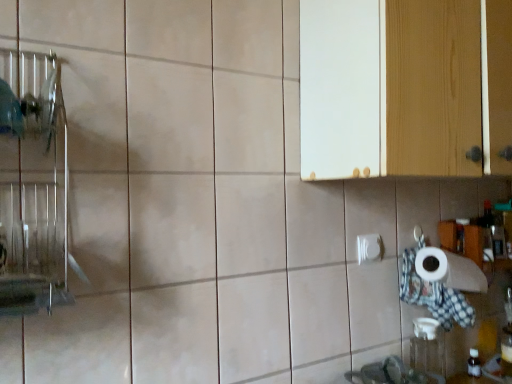
Question: Considering the relative sizes of white glossy toilet paper at lower right and white wood cabinet at upper right in the image provided, is white glossy toilet paper at lower right shorter than white wood cabinet at upper right?

Choices:
 (A) yes
 (B) no

Answer: (A)

Question: Is white glossy toilet paper at lower right at the left side of white wood cabinet at upper right?

Choices:
 (A) yes
 (B) no

Answer: (A)

Question: Does white glossy toilet paper at lower right touch white wood cabinet at upper right?

Choices:
 (A) no
 (B) yes

Answer: (A)

Question: From a real-world perspective, is white glossy toilet paper at lower right beneath white wood cabinet at upper right?

Choices:
 (A) yes
 (B) no

Answer: (A)

Question: Would you say white glossy toilet paper at lower right is a long distance from white wood cabinet at upper right?

Choices:
 (A) yes
 (B) no

Answer: (B)

Question: Could white wood cabinet at upper right be considered to be inside white glossy toilet paper at lower right?

Choices:
 (A) yes
 (B) no

Answer: (B)

Question: Is white wood cabinet at upper right placed right next to white glossy toilet paper at lower right?

Choices:
 (A) no
 (B) yes

Answer: (A)

Question: From the image's perspective, is white wood cabinet at upper right over white glossy toilet paper at lower right?

Choices:
 (A) yes
 (B) no

Answer: (A)

Question: Does white wood cabinet at upper right have a lesser height compared to white glossy toilet paper at lower right?

Choices:
 (A) no
 (B) yes

Answer: (A)

Question: Considering the relative positions of white wood cabinet at upper right and white glossy toilet paper at lower right in the image provided, is white wood cabinet at upper right to the right of white glossy toilet paper at lower right from the viewer's perspective?

Choices:
 (A) yes
 (B) no

Answer: (A)

Question: From the image's perspective, is white wood cabinet at upper right under white glossy toilet paper at lower right?

Choices:
 (A) no
 (B) yes

Answer: (A)

Question: Does white wood cabinet at upper right lie behind white glossy toilet paper at lower right?

Choices:
 (A) yes
 (B) no

Answer: (B)

Question: Looking at their shapes, would you say white glossy toilet paper at lower right is wider or thinner than white wood cabinet at upper right?

Choices:
 (A) thin
 (B) wide

Answer: (A)